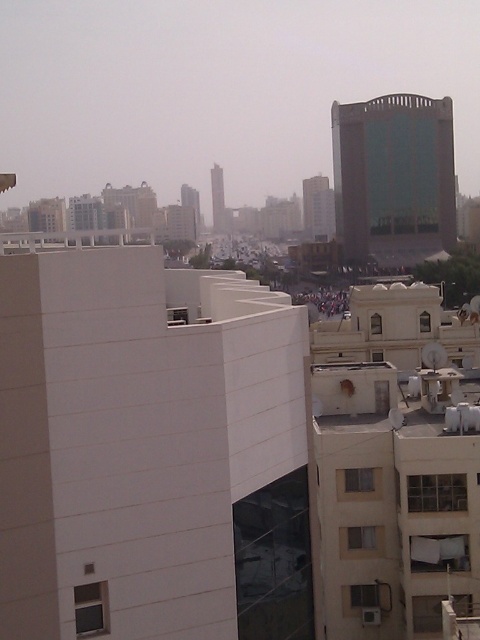
Question: In this image, where is white smooth building at center located relative to green glass building at upper center?

Choices:
 (A) right
 (B) left

Answer: (B)

Question: Can you confirm if white smooth building at center is wider than green glass building at upper center?

Choices:
 (A) no
 (B) yes

Answer: (A)

Question: Is white smooth building at center thinner than green glass building at upper center?

Choices:
 (A) yes
 (B) no

Answer: (A)

Question: Which object appears farthest from the camera in this image?

Choices:
 (A) white smooth building at center
 (B) green glass building at upper center

Answer: (B)

Question: Which of the following is the farthest from the observer?

Choices:
 (A) click(292, 573)
 (B) click(362, 132)

Answer: (B)

Question: Which point is closer to the camera taking this photo?

Choices:
 (A) (27, 273)
 (B) (423, 256)

Answer: (A)